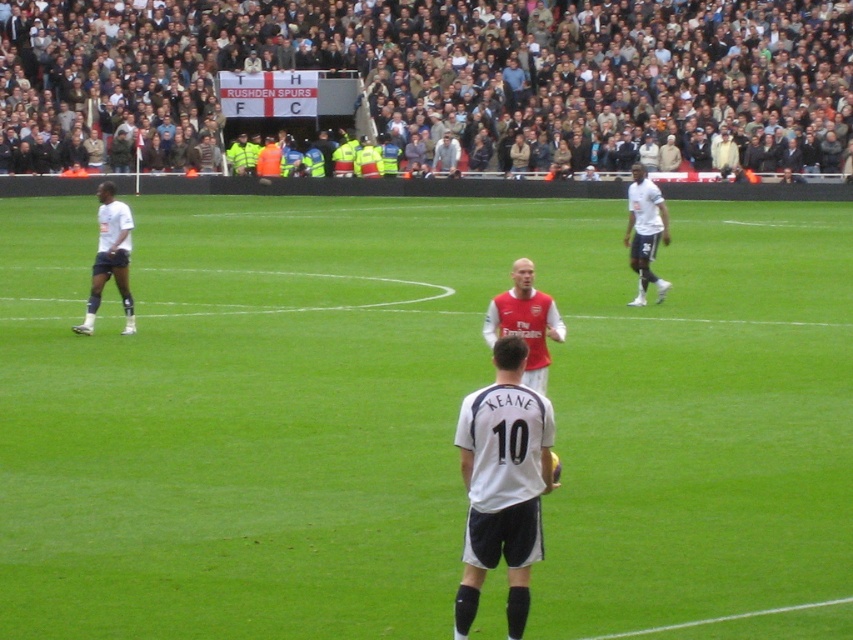
Question: Considering the real-world distances, which object is closest to the red jersey at center?

Choices:
 (A) white jersey at center
 (B) dark gray crowd at upper center

Answer: (A)

Question: Is dark gray crowd at upper center below white matte jersey at right?

Choices:
 (A) no
 (B) yes

Answer: (A)

Question: Based on their relative distances, which object is nearer to the red jersey at center?

Choices:
 (A) white matte jersey at right
 (B) dark gray crowd at upper center
 (C) white matte shorts at left

Answer: (C)

Question: Is red jersey at center to the right of white matte jersey at right from the viewer's perspective?

Choices:
 (A) yes
 (B) no

Answer: (B)

Question: Does white jersey at center have a lesser width compared to white matte shorts at left?

Choices:
 (A) yes
 (B) no

Answer: (A)

Question: Estimate the real-world distances between objects in this image. Which object is farther from the green grass field at center?

Choices:
 (A) white matte shorts at left
 (B) white matte jersey at right
 (C) dark gray crowd at upper center
 (D) white jersey at center

Answer: (C)